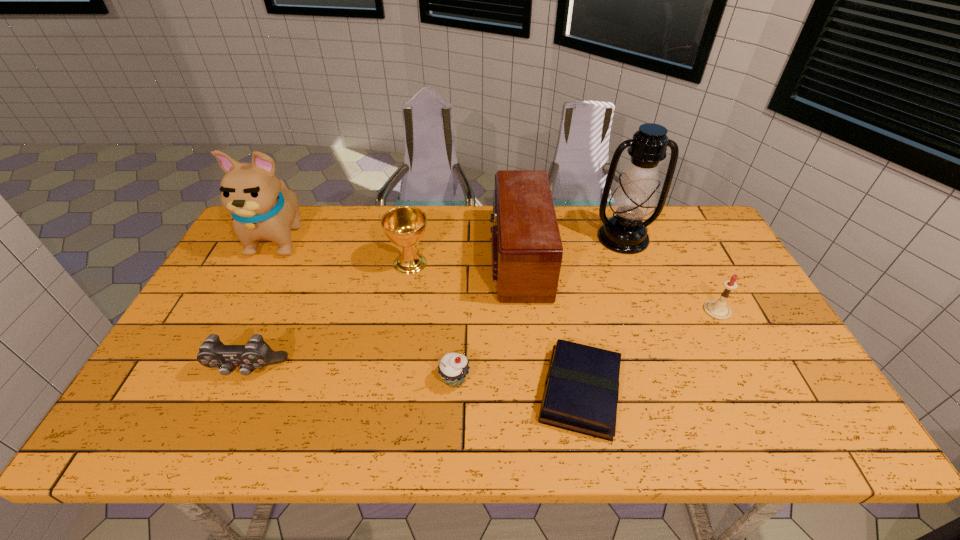
Identify the location of object that stands as the seventh closest to the second object from right to left. (262, 206).

Locate an element on the screen. Image resolution: width=960 pixels, height=540 pixels. object that is the fifth closest to the control is located at coordinates (581, 391).

The image size is (960, 540). Find the location of `vacant region that satisfies the following two spatial constraints: 1. on the back side of the second object from right to left; 2. on the right side of the fifth shortest object`. vacant region that satisfies the following two spatial constraints: 1. on the back side of the second object from right to left; 2. on the right side of the fifth shortest object is located at coordinates tap(415, 238).

Find the location of a particular element. vacant area in the image that satisfies the following two spatial constraints: 1. on the front-facing side of the third tallest object; 2. on the front side of the fifth shortest object is located at coordinates (518, 263).

At what (x,y) coordinates should I click in order to perform the action: click on vacant space that satisfies the following two spatial constraints: 1. on the face of the second object from right to left; 2. on the left side of the puppy. Please return your answer as a coordinate pair (x, y). Looking at the image, I should click on (279, 238).

Identify the location of free space that satisfies the following two spatial constraints: 1. on the front-facing side of the candle; 2. on the right side of the radio receiver. This screenshot has width=960, height=540. (523, 310).

In order to click on vacant area that satisfies the following two spatial constraints: 1. on the front side of the candle; 2. on the right side of the third object from left to right in this screenshot , I will do `click(402, 310)`.

Where is `blank space that satisfies the following two spatial constraints: 1. on the front side of the book; 2. on the right side of the cupcake`? This screenshot has width=960, height=540. blank space that satisfies the following two spatial constraints: 1. on the front side of the book; 2. on the right side of the cupcake is located at coordinates (454, 393).

At what (x,y) coordinates should I click in order to perform the action: click on vacant space that satisfies the following two spatial constraints: 1. on the front-facing side of the radio receiver; 2. on the front side of the fifth object from right to left. Please return your answer as a coordinate pair (x, y). Looking at the image, I should click on (530, 380).

Find the location of a particular element. The height and width of the screenshot is (540, 960). free location that satisfies the following two spatial constraints: 1. on the front-facing side of the radio receiver; 2. on the front side of the fifth shortest object is located at coordinates (518, 263).